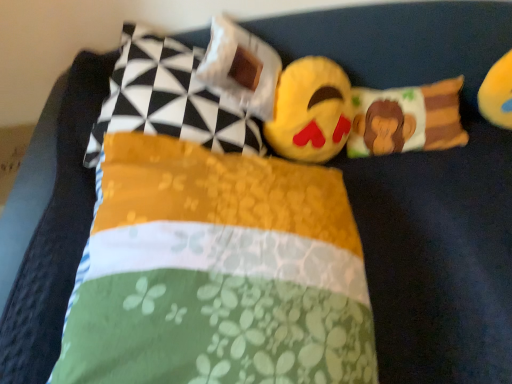
What is the approximate width of fluffy fabric monkey pillow at center, which ranks as the 1th pillow in right-to-left order?

fluffy fabric monkey pillow at center, which ranks as the 1th pillow in right-to-left order, is 7.05 inches wide.

The image size is (512, 384). Identify the location of fluffy fabric monkey pillow at center, which ranks as the 1th pillow in right-to-left order. (406, 119).

I want to click on yellow fabric pillow at upper left, the fourth pillow in the right-to-left sequence, so point(169,99).

Identify the location of soft plush emoji at center, the first toy when ordered from left to right. (311, 111).

Where is `fluffy fabric monkey pillow at center, which ranks as the 1th pillow in right-to-left order`? The width and height of the screenshot is (512, 384). fluffy fabric monkey pillow at center, which ranks as the 1th pillow in right-to-left order is located at coordinates (406, 119).

In the scene shown: From the image's perspective, is white fabric pillow at upper center, positioned as the third pillow in right-to-left order, above or below yellow fabric pillow at upper left, which ranks as the first pillow in left-to-right order?

Based on their image positions, white fabric pillow at upper center, positioned as the third pillow in right-to-left order, is located above yellow fabric pillow at upper left, which ranks as the first pillow in left-to-right order.

Could you measure the distance between white fabric pillow at upper center, positioned as the third pillow in right-to-left order, and yellow fabric pillow at upper left, which ranks as the first pillow in left-to-right order?

A distance of 4.15 inches exists between white fabric pillow at upper center, positioned as the third pillow in right-to-left order, and yellow fabric pillow at upper left, which ranks as the first pillow in left-to-right order.

Considering the positions of point (240, 61) and point (118, 98), is point (240, 61) closer or farther from the camera than point (118, 98)?

Point (240, 61) is farther from the camera than point (118, 98).

Consider the image. Is white fabric pillow at upper center, positioned as the third pillow in right-to-left order, situated inside yellow fabric pillow at upper left, the fourth pillow in the right-to-left sequence, or outside?

white fabric pillow at upper center, positioned as the third pillow in right-to-left order, exists entirely within yellow fabric pillow at upper left, the fourth pillow in the right-to-left sequence.

How many degrees apart are the facing directions of fluffy fabric monkey pillow at center, which ranks as the 1th pillow in right-to-left order, and soft plush emoji at center, the first toy when ordered from left to right?

The angular difference between fluffy fabric monkey pillow at center, which ranks as the 1th pillow in right-to-left order, and soft plush emoji at center, the first toy when ordered from left to right, is 9.07 degrees.

Which is more to the left, fluffy fabric monkey pillow at center, which ranks as the 1th pillow in right-to-left order, or soft plush emoji at center, acting as the second toy starting from the right?

soft plush emoji at center, acting as the second toy starting from the right.

From a real-world perspective, which is physically below, fluffy fabric monkey pillow at center, arranged as the fourth pillow when viewed from the left, or soft plush emoji at center, acting as the second toy starting from the right?

In real-world perspective, fluffy fabric monkey pillow at center, arranged as the fourth pillow when viewed from the left, is lower.

Is point (415, 102) positioned behind point (304, 58)?

Yes, point (415, 102) is behind point (304, 58).

Can you confirm if white fabric pillow at upper center, the second pillow positioned from the left, is smaller than yellow plush toy at upper right, acting as the 2th toy starting from the left?

Actually, white fabric pillow at upper center, the second pillow positioned from the left, might be larger than yellow plush toy at upper right, acting as the 2th toy starting from the left.

Does white fabric pillow at upper center, positioned as the third pillow in right-to-left order, contain yellow plush toy at upper right, acting as the 2th toy starting from the left?

Definitely not — yellow plush toy at upper right, acting as the 2th toy starting from the left, is not inside white fabric pillow at upper center, positioned as the third pillow in right-to-left order.

Which of these two, white fabric pillow at upper center, the second pillow positioned from the left, or yellow plush toy at upper right, which appears as the 1th toy when viewed from the right, is thinner?

Thinner between the two is yellow plush toy at upper right, which appears as the 1th toy when viewed from the right.

From the white fabric pillow at upper center, the second pillow positioned from the left, count 2nd toy to the right and point to it. Please provide its 2D coordinates.

[(497, 93)]

How distant is yellow plush toy at upper right, which appears as the 1th toy when viewed from the right, from soft plush emoji at center, the first toy when ordered from left to right?

yellow plush toy at upper right, which appears as the 1th toy when viewed from the right, and soft plush emoji at center, the first toy when ordered from left to right, are 20.76 inches apart.

From a real-world perspective, relative to soft plush emoji at center, acting as the second toy starting from the right, is yellow plush toy at upper right, which appears as the 1th toy when viewed from the right, vertically above or below?

Clearly, from a real-world perspective, yellow plush toy at upper right, which appears as the 1th toy when viewed from the right, is below soft plush emoji at center, acting as the second toy starting from the right.

Which of these two, yellow plush toy at upper right, acting as the 2th toy starting from the left, or soft plush emoji at center, acting as the second toy starting from the right, is wider?

Wider between the two is soft plush emoji at center, acting as the second toy starting from the right.

Could you measure the distance between white fabric pillow at upper center, the second pillow positioned from the left, and fluffy fabric monkey pillow at center, which ranks as the 1th pillow in right-to-left order?

The distance of white fabric pillow at upper center, the second pillow positioned from the left, from fluffy fabric monkey pillow at center, which ranks as the 1th pillow in right-to-left order, is 16.55 inches.

Is point (210, 61) in front of point (358, 114)?

That is True.

In the scene shown: Considering the relative positions of white fabric pillow at upper center, positioned as the third pillow in right-to-left order, and fluffy fabric monkey pillow at center, arranged as the fourth pillow when viewed from the left, in the image provided, is white fabric pillow at upper center, positioned as the third pillow in right-to-left order, to the left of fluffy fabric monkey pillow at center, arranged as the fourth pillow when viewed from the left, from the viewer's perspective?

Yes.

Choose the correct answer: Is white fabric pillow at upper center, the second pillow positioned from the left, inside fluffy fabric monkey pillow at center, which ranks as the 1th pillow in right-to-left order, or outside it?

white fabric pillow at upper center, the second pillow positioned from the left, is not inside fluffy fabric monkey pillow at center, which ranks as the 1th pillow in right-to-left order, it's outside.

Which is behind, point (506, 91) or point (217, 203)?

The point (506, 91) is farther.

Is yellow plush toy at upper right, acting as the 2th toy starting from the left, inside the boundaries of floral fabric pillow at center, which is counted as the third pillow, starting from the left, or outside?

yellow plush toy at upper right, acting as the 2th toy starting from the left, is not inside floral fabric pillow at center, which is counted as the third pillow, starting from the left, it's outside.

From a real-world perspective, is yellow plush toy at upper right, acting as the 2th toy starting from the left, above or below floral fabric pillow at center, which is counted as the third pillow, starting from the left?

yellow plush toy at upper right, acting as the 2th toy starting from the left, is below floral fabric pillow at center, which is counted as the third pillow, starting from the left.

Based on the photo, could you tell me if yellow plush toy at upper right, acting as the 2th toy starting from the left, is facing floral fabric pillow at center, marked as the second pillow in a right-to-left arrangement?

No, yellow plush toy at upper right, acting as the 2th toy starting from the left, is not oriented towards floral fabric pillow at center, marked as the second pillow in a right-to-left arrangement.

Could you tell me if soft plush emoji at center, the first toy when ordered from left to right, is turned towards white fabric pillow at upper center, the second pillow positioned from the left?

No, soft plush emoji at center, the first toy when ordered from left to right, is not facing towards white fabric pillow at upper center, the second pillow positioned from the left.

Who is taller, soft plush emoji at center, the first toy when ordered from left to right, or white fabric pillow at upper center, the second pillow positioned from the left?

soft plush emoji at center, the first toy when ordered from left to right.

Which object is positioned more to the left, soft plush emoji at center, acting as the second toy starting from the right, or white fabric pillow at upper center, the second pillow positioned from the left?

white fabric pillow at upper center, the second pillow positioned from the left.

Which object is more forward, soft plush emoji at center, the first toy when ordered from left to right, or white fabric pillow at upper center, the second pillow positioned from the left?

white fabric pillow at upper center, the second pillow positioned from the left, is in front.

Starting from the white fabric pillow at upper center, positioned as the third pillow in right-to-left order, which pillow is the 1st one in front? Please provide its 2D coordinates.

[(169, 99)]

Find the location of a particular element. The width and height of the screenshot is (512, 384). toy that is below the fluffy fabric monkey pillow at center, which ranks as the 1th pillow in right-to-left order (from the image's perspective) is located at coordinates (311, 111).

Estimate the real-world distances between objects in this image. Which object is closer to white fabric pillow at upper center, the second pillow positioned from the left, fluffy fabric monkey pillow at center, which ranks as the 1th pillow in right-to-left order, or yellow fabric pillow at upper left, the fourth pillow in the right-to-left sequence?

yellow fabric pillow at upper left, the fourth pillow in the right-to-left sequence, is positioned closer to the anchor white fabric pillow at upper center, the second pillow positioned from the left.

Looking at this image, based on their spatial positions, is fluffy fabric monkey pillow at center, arranged as the fourth pillow when viewed from the left, or white fabric pillow at upper center, positioned as the third pillow in right-to-left order, closer to yellow fabric pillow at upper left, the fourth pillow in the right-to-left sequence?

white fabric pillow at upper center, positioned as the third pillow in right-to-left order.

Based on their spatial positions, is soft plush emoji at center, acting as the second toy starting from the right, or yellow fabric pillow at upper left, which ranks as the first pillow in left-to-right order, further from floral fabric pillow at center, which is counted as the third pillow, starting from the left?

The object further to floral fabric pillow at center, which is counted as the third pillow, starting from the left, is soft plush emoji at center, acting as the second toy starting from the right.

Estimate the real-world distances between objects in this image. Which object is further from soft plush emoji at center, the first toy when ordered from left to right, floral fabric pillow at center, marked as the second pillow in a right-to-left arrangement, or fluffy fabric monkey pillow at center, which ranks as the 1th pillow in right-to-left order?

floral fabric pillow at center, marked as the second pillow in a right-to-left arrangement, is positioned further to the anchor soft plush emoji at center, the first toy when ordered from left to right.

When comparing their distances from fluffy fabric monkey pillow at center, which ranks as the 1th pillow in right-to-left order, does yellow fabric pillow at upper left, which ranks as the first pillow in left-to-right order, or soft plush emoji at center, the first toy when ordered from left to right, seem closer?

The object closer to fluffy fabric monkey pillow at center, which ranks as the 1th pillow in right-to-left order, is soft plush emoji at center, the first toy when ordered from left to right.

Estimate the real-world distances between objects in this image. Which object is closer to yellow plush toy at upper right, which appears as the 1th toy when viewed from the right, yellow fabric pillow at upper left, the fourth pillow in the right-to-left sequence, or white fabric pillow at upper center, positioned as the third pillow in right-to-left order?

Based on the image, white fabric pillow at upper center, positioned as the third pillow in right-to-left order, appears to be nearer to yellow plush toy at upper right, which appears as the 1th toy when viewed from the right.

Consider the image. From the image, which object appears to be nearer to fluffy fabric monkey pillow at center, arranged as the fourth pillow when viewed from the left, yellow plush toy at upper right, acting as the 2th toy starting from the left, or floral fabric pillow at center, which is counted as the third pillow, starting from the left?

yellow plush toy at upper right, acting as the 2th toy starting from the left, is positioned closer to the anchor fluffy fabric monkey pillow at center, arranged as the fourth pillow when viewed from the left.

Which object lies nearer to the anchor point white fabric pillow at upper center, positioned as the third pillow in right-to-left order, fluffy fabric monkey pillow at center, arranged as the fourth pillow when viewed from the left, or floral fabric pillow at center, marked as the second pillow in a right-to-left arrangement?

Based on the image, floral fabric pillow at center, marked as the second pillow in a right-to-left arrangement, appears to be nearer to white fabric pillow at upper center, positioned as the third pillow in right-to-left order.

The image size is (512, 384). I want to click on toy located between floral fabric pillow at center, which is counted as the third pillow, starting from the left, and yellow plush toy at upper right, acting as the 2th toy starting from the left, in the left-right direction, so click(x=311, y=111).

In order to click on pillow between floral fabric pillow at center, which is counted as the third pillow, starting from the left, and yellow plush toy at upper right, acting as the 2th toy starting from the left, from left to right in this screenshot , I will do `click(406, 119)`.

Locate an element on the screen. toy between yellow fabric pillow at upper left, which ranks as the first pillow in left-to-right order, and yellow plush toy at upper right, acting as the 2th toy starting from the left, from left to right is located at coordinates (311, 111).

Identify the location of toy between yellow fabric pillow at upper left, the fourth pillow in the right-to-left sequence, and fluffy fabric monkey pillow at center, arranged as the fourth pillow when viewed from the left, in the horizontal direction. (311, 111).